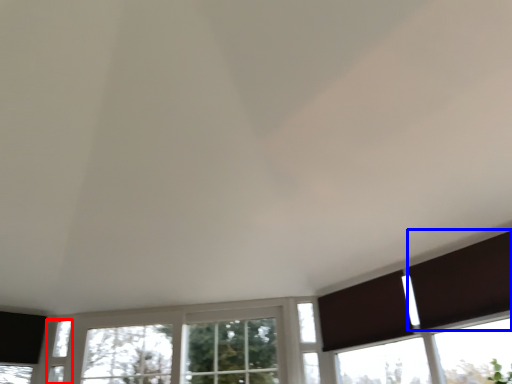
Question: Which point is closer to the camera, window (highlighted by a red box) or shutter (highlighted by a blue box)?

Choices:
 (A) window
 (B) shutter

Answer: (B)